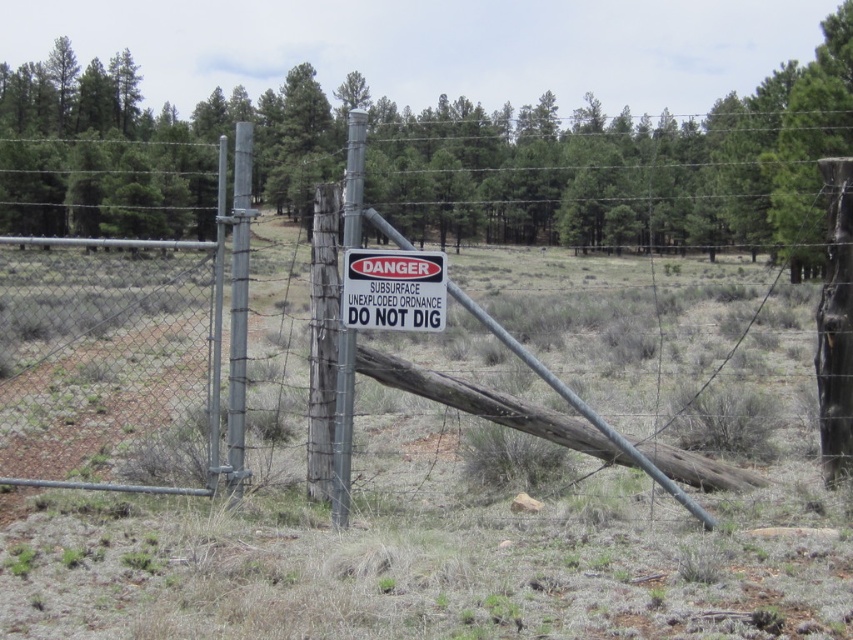
Is metallic gray pole at center-left positioned before metallic gray pole at center?

That is False.

Between metallic gray pole at center-left and metallic gray pole at center, which one is positioned higher?

Positioned higher is metallic gray pole at center-left.

Where is `metallic gray pole at center-left`? The height and width of the screenshot is (640, 853). metallic gray pole at center-left is located at coordinates (238, 307).

Who is shorter, metal wire fence at center or metallic gray pole at center-left?

Standing shorter between the two is metal wire fence at center.

Measure the distance between metal wire fence at center and camera.

6.42 meters

Locate an element on the screen. metal wire fence at center is located at coordinates (579, 406).

Is green textured log at center shorter than metallic gray pole at center-left?

No, green textured log at center is not shorter than metallic gray pole at center-left.

Who is more distant from viewer, (154, 179) or (244, 241)?

The point (154, 179) is more distant.

Who is more forward, (x=509, y=120) or (x=241, y=182)?

Point (x=241, y=182) is more forward.

The image size is (853, 640). What are the coordinates of `green textured log at center` in the screenshot? It's located at click(x=437, y=160).